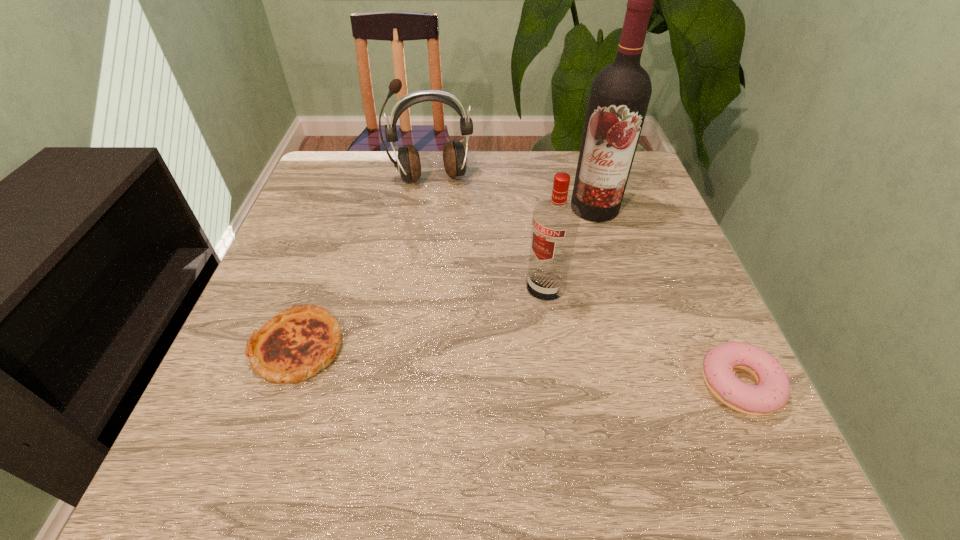
Identify the location of free space on the desktop that is between the leftmost object and the second shortest object and is positioned on the ear pads of the fourth object from right to left. The width and height of the screenshot is (960, 540). (468, 361).

What are the coordinates of `free space on the desktop that is between the leftmost object and the doughnut and is positioned on the label of the wine bottle` in the screenshot? It's located at (488, 363).

Where is `free space on the desktop that is between the shortest object and the rightmost object and is positioned on the front label of the third nearest object`? Image resolution: width=960 pixels, height=540 pixels. free space on the desktop that is between the shortest object and the rightmost object and is positioned on the front label of the third nearest object is located at coordinates (468, 361).